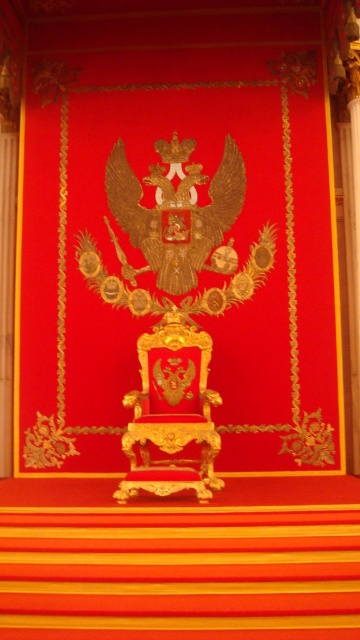
Question: Which of the following is the farthest from the observer?

Choices:
 (A) goldmaterial/texturethrone at center
 (B) gold/gilded eagle at center

Answer: (B)

Question: Does gold/gilded eagle at center appear over goldmaterial/texturethrone at center?

Choices:
 (A) yes
 (B) no

Answer: (A)

Question: Can you confirm if gold/gilded eagle at center is positioned to the left of goldmaterial/texturethrone at center?

Choices:
 (A) yes
 (B) no

Answer: (A)

Question: Which point is closer to the camera?

Choices:
 (A) gold/gilded eagle at center
 (B) goldmaterial/texturethrone at center

Answer: (B)

Question: Considering the relative positions of gold/gilded eagle at center and goldmaterial/texturethrone at center in the image provided, where is gold/gilded eagle at center located with respect to goldmaterial/texturethrone at center?

Choices:
 (A) right
 (B) left

Answer: (B)